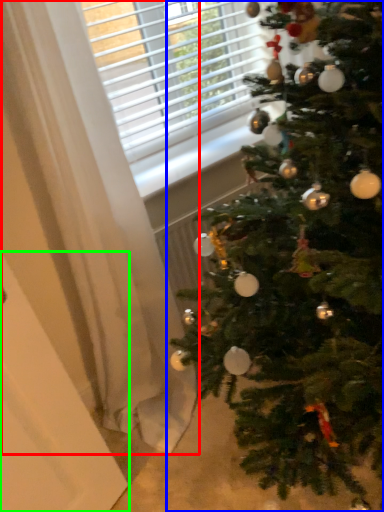
Question: Which object is positioned closest to curtain (highlighted by a red box)? Select from christmas tree (highlighted by a blue box) and screen door (highlighted by a green box).

Choices:
 (A) christmas tree
 (B) screen door

Answer: (B)